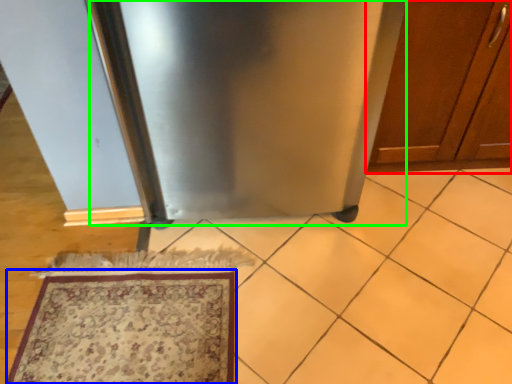
Question: Which object is positioned farthest from cabinetry (highlighted by a red box)? Select from mat (highlighted by a blue box) and appliance (highlighted by a green box).

Choices:
 (A) mat
 (B) appliance

Answer: (A)